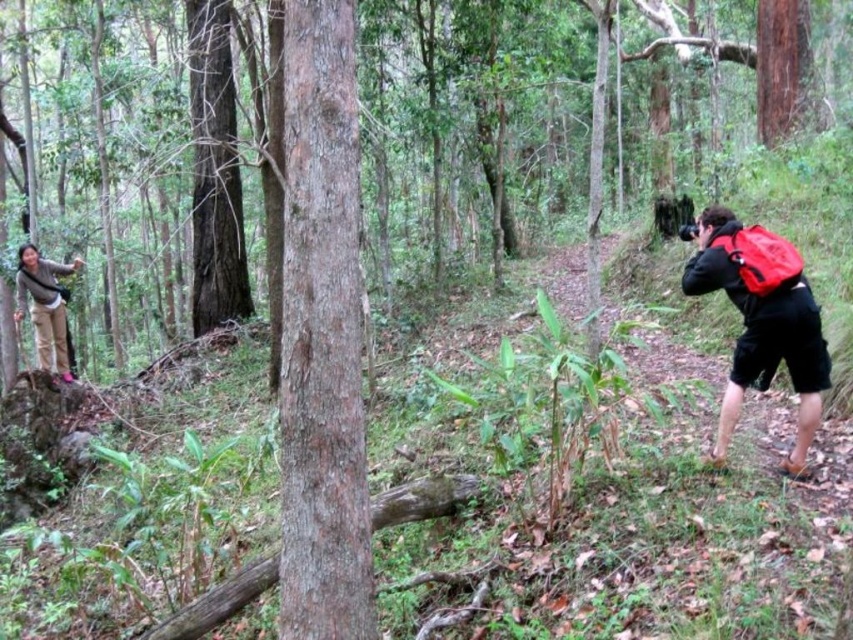
Question: From the image, what is the correct spatial relationship of matte beige pants at left in relation to red matte backpack at right?

Choices:
 (A) below
 (B) above

Answer: (A)

Question: Among these points, which one is nearest to the camera?

Choices:
 (A) pos(312,170)
 (B) pos(750,260)

Answer: (A)

Question: Which point is farther from the camera taking this photo?

Choices:
 (A) (44, 337)
 (B) (286, 195)
 (C) (749, 344)
 (D) (755, 230)

Answer: (A)

Question: Is red fabric backpack at right wider than red matte backpack at right?

Choices:
 (A) yes
 (B) no

Answer: (A)

Question: Can you confirm if smooth brown tree trunk at center is smaller than red matte backpack at right?

Choices:
 (A) no
 (B) yes

Answer: (A)

Question: Which point is closer to the camera taking this photo?

Choices:
 (A) (804, 323)
 (B) (737, 236)
 (C) (285, 20)

Answer: (C)